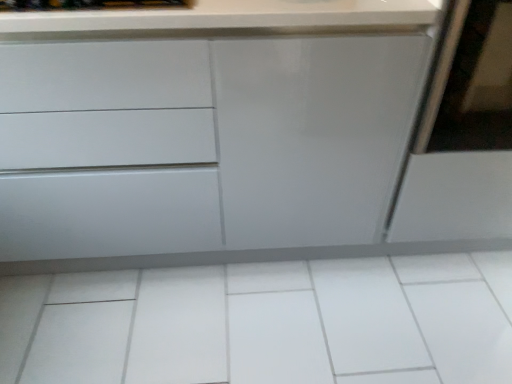
Question: Considering their positions, is matte white cabinet at center located in front of or behind white glossy tile at center?

Choices:
 (A) behind
 (B) front

Answer: (B)

Question: Considering the relative positions of matte white cabinet at center and white glossy tile at center in the image provided, is matte white cabinet at center to the left or to the right of white glossy tile at center?

Choices:
 (A) left
 (B) right

Answer: (A)

Question: Which of these objects is positioned closest to the matte white screen door at right?

Choices:
 (A) matte white cabinet at center
 (B) white glossy tile at center

Answer: (A)

Question: Which object is positioned farthest from the matte white cabinet at center?

Choices:
 (A) white glossy tile at center
 (B) matte white screen door at right

Answer: (A)